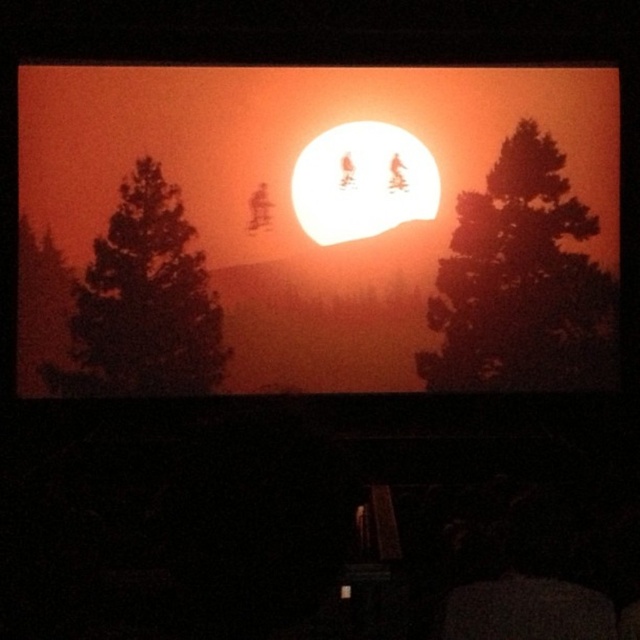
What are the coordinates of the matte orange sun at center?

The matte orange sun at center is located at coordinates point (316,228).

You are a movie director analyzing a sunset scene. You notice the matte orange sun at center and the silhouette pine tree at left. Which object is located to the right of the other?

The matte orange sun at center is positioned on the right side of the silhouette pine tree at left.

You are an astronomer observing the sunset scene projected on a screen. You notice the matte orange sun at center and the silhouette pine tree at left. Which object appears larger in the image?

The matte orange sun at center appears larger than the silhouette pine tree at left in the image.